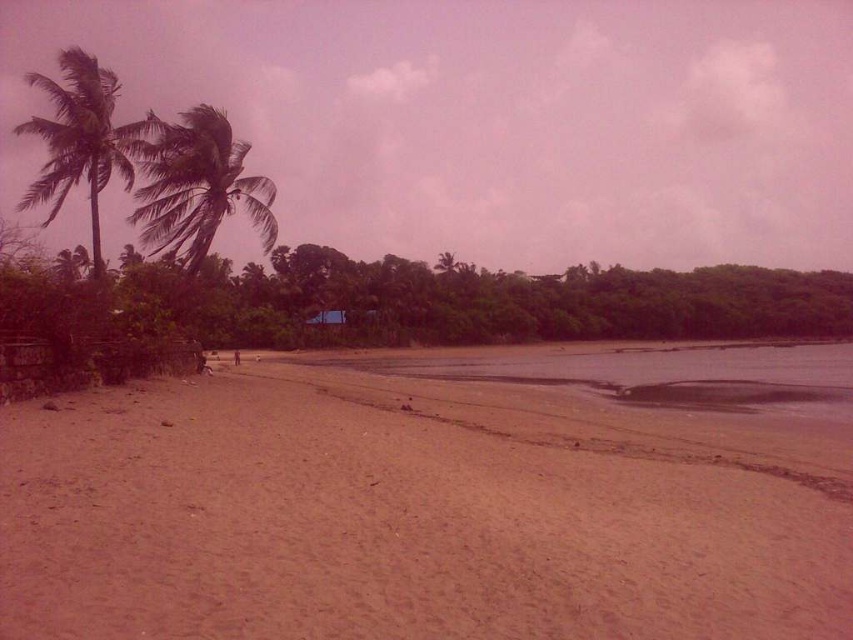
Consider the image. Is green leafy palm tree at left to the left of green leafy palm tree at upper left from the viewer's perspective?

No, green leafy palm tree at left is not to the left of green leafy palm tree at upper left.

Which is more to the left, green leafy palm tree at left or green leafy palm tree at upper left?

green leafy palm tree at upper left is more to the left.

Measure the distance between point (219, 198) and camera.

The distance of point (219, 198) from camera is 27.82 meters.

Identify the location of green leafy palm tree at left. Image resolution: width=853 pixels, height=640 pixels. (196, 186).

Between sandy beach at lower left and green leafy palm tree at left, which one appears on the right side from the viewer's perspective?

From the viewer's perspective, sandy beach at lower left appears more on the right side.

Does sandy beach at lower left have a lesser height compared to green leafy palm tree at left?

Correct, sandy beach at lower left is not as tall as green leafy palm tree at left.

Is point (662, 616) positioned behind point (190, 147)?

No, it is in front of (190, 147).

Identify the location of sandy beach at lower left. This screenshot has height=640, width=853. (440, 499).

Does sandy beach at lower left have a lesser width compared to green leafy palm tree at upper left?

Indeed, sandy beach at lower left has a lesser width compared to green leafy palm tree at upper left.

Which is behind, point (724, 541) or point (62, 148)?

Point (62, 148)

Image resolution: width=853 pixels, height=640 pixels. I want to click on sandy beach at lower left, so click(440, 499).